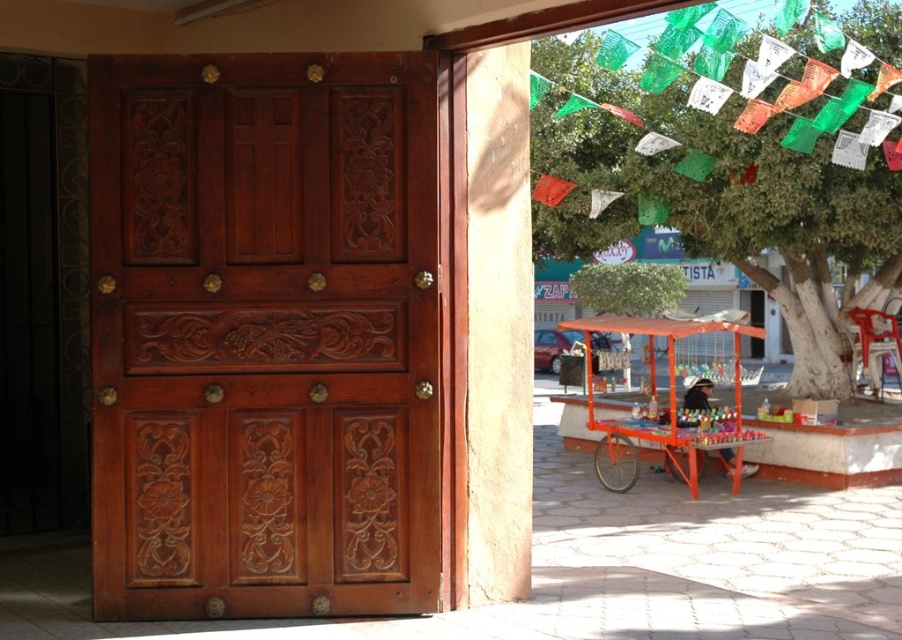
Between polished wood door at left and orange metallic cart at center, which one appears on the left side from the viewer's perspective?

polished wood door at left

Does polished wood door at left appear on the left side of orange metallic cart at center?

Indeed, polished wood door at left is positioned on the left side of orange metallic cart at center.

Locate an element on the screen. Image resolution: width=902 pixels, height=640 pixels. polished wood door at left is located at coordinates [263, 336].

Between polished wood door at left and green leafy tree at upper right, which one is positioned lower?

polished wood door at left is lower down.

Can you confirm if polished wood door at left is thinner than green leafy tree at upper right?

No.

You are a GUI agent. You are given a task and a screenshot of the screen. Output one action in this format:
    pyautogui.click(x=<x>, y=<y>)
    Task: Click on the polished wood door at left
    The image size is (902, 640).
    Given the screenshot: What is the action you would take?
    pyautogui.click(x=263, y=336)

Where is `polished wood door at left`? The image size is (902, 640). polished wood door at left is located at coordinates (263, 336).

Which is more to the left, green leafy tree at upper right or orange metallic cart at center?

Positioned to the left is orange metallic cart at center.

Can you confirm if green leafy tree at upper right is positioned to the left of orange metallic cart at center?

Incorrect, green leafy tree at upper right is not on the left side of orange metallic cart at center.

Where is `green leafy tree at upper right`? This screenshot has height=640, width=902. green leafy tree at upper right is located at coordinates (738, 166).

What are the coordinates of `green leafy tree at upper right` in the screenshot? It's located at (738, 166).